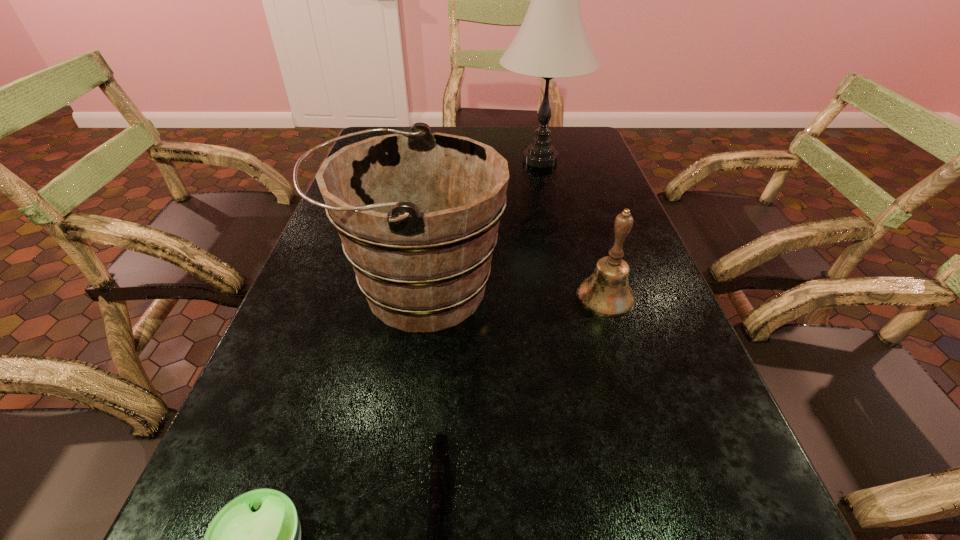
Find the location of a particular element. The image size is (960, 540). lamp is located at coordinates (552, 42).

Identify the location of the farthest object. (552, 42).

Find the location of a particular element. This screenshot has height=540, width=960. bucket is located at coordinates (418, 212).

You are a GUI agent. You are given a task and a screenshot of the screen. Output one action in this format:
    pyautogui.click(x=<x>, y=<y>)
    Task: Click on the bell
    Image resolution: width=960 pixels, height=540 pixels.
    Given the screenshot: What is the action you would take?
    606,293

At what (x,y) coordinates should I click in order to perform the action: click on vacant space positioned on the front of the farthest object. Please return your answer as a coordinate pair (x, y). This screenshot has height=540, width=960. Looking at the image, I should click on (557, 232).

This screenshot has width=960, height=540. Find the location of `vacant space located on the front of the third tallest object`. vacant space located on the front of the third tallest object is located at coordinates (x=643, y=420).

At what (x,y) coordinates should I click in order to perform the action: click on object located at the far edge. Please return your answer as a coordinate pair (x, y). Looking at the image, I should click on (552, 42).

You are a GUI agent. You are given a task and a screenshot of the screen. Output one action in this format:
    pyautogui.click(x=<x>, y=<y>)
    Task: Click on the object present at the left edge
    The width and height of the screenshot is (960, 540).
    Given the screenshot: What is the action you would take?
    pyautogui.click(x=418, y=212)

Find the location of `lamp at the right edge`. lamp at the right edge is located at coordinates (552, 42).

What are the coordinates of `bell situated at the right edge` in the screenshot? It's located at (606, 293).